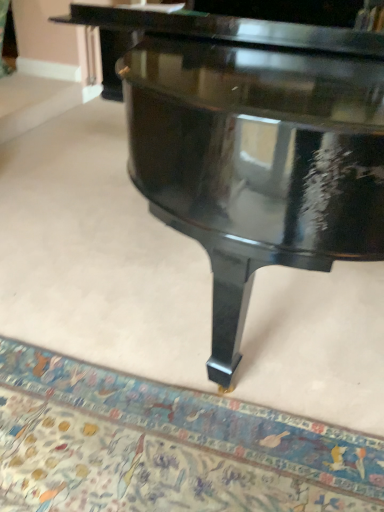
This screenshot has width=384, height=512. What do you see at coordinates (165, 446) in the screenshot? I see `carpet with intricate patterns at lower center` at bounding box center [165, 446].

Measure the distance between carpet with intricate patterns at lower center and camera.

carpet with intricate patterns at lower center is 3.70 feet away from camera.

Identify the location of carpet with intricate patterns at lower center. (165, 446).

What is the approximate width of glossy black piano at center?

It is 6.06 feet.

At what (x,y) coordinates should I click in order to perform the action: click on glossy black piano at center. Please return your answer as a coordinate pair (x, y). This screenshot has height=512, width=384. Looking at the image, I should click on (256, 162).

Measure the distance between glossy black piano at center and camera.

The depth of glossy black piano at center is 75.83 centimeters.

This screenshot has height=512, width=384. Describe the element at coordinates (256, 162) in the screenshot. I see `glossy black piano at center` at that location.

The height and width of the screenshot is (512, 384). Identify the location of carpet with intricate patterns at lower center. (165, 446).

Considering the relative positions of glossy black piano at center and carpet with intricate patterns at lower center in the image provided, is glossy black piano at center to the right of carpet with intricate patterns at lower center from the viewer's perspective?

Indeed, glossy black piano at center is positioned on the right side of carpet with intricate patterns at lower center.

Is glossy black piano at center further to camera compared to carpet with intricate patterns at lower center?

No, glossy black piano at center is closer to the viewer.

Does point (211, 234) come behind point (231, 477)?

No, it is in front of (231, 477).

From the image's perspective, is glossy black piano at center on carpet with intricate patterns at lower center?

Correct, glossy black piano at center appears higher than carpet with intricate patterns at lower center in the image.

From a real-world perspective, which object rests below the other?

In real-world perspective, carpet with intricate patterns at lower center is lower.

Considering the relative sizes of glossy black piano at center and carpet with intricate patterns at lower center in the image provided, is glossy black piano at center wider than carpet with intricate patterns at lower center?

Correct, the width of glossy black piano at center exceeds that of carpet with intricate patterns at lower center.

Considering the sizes of objects glossy black piano at center and carpet with intricate patterns at lower center in the image provided, who is taller, glossy black piano at center or carpet with intricate patterns at lower center?

Standing taller between the two is glossy black piano at center.

Between glossy black piano at center and carpet with intricate patterns at lower center, which one has smaller size?

With smaller size is carpet with intricate patterns at lower center.

In the scene shown: Is glossy black piano at center outside of carpet with intricate patterns at lower center?

Yes.

Is there a large distance between glossy black piano at center and carpet with intricate patterns at lower center?

No, glossy black piano at center is not far away from carpet with intricate patterns at lower center.

Is glossy black piano at center oriented towards carpet with intricate patterns at lower center?

No, glossy black piano at center does not turn towards carpet with intricate patterns at lower center.

In the scene shown: How different are the orientations of glossy black piano at center and carpet with intricate patterns at lower center in degrees?

4.07 degrees separate the facing orientations of glossy black piano at center and carpet with intricate patterns at lower center.

Where is `mat below the glossy black piano at center (from a real-world perspective)`? mat below the glossy black piano at center (from a real-world perspective) is located at coordinates (165, 446).

From the picture: Is carpet with intricate patterns at lower center at the right side of glossy black piano at center?

No, carpet with intricate patterns at lower center is not to the right of glossy black piano at center.

Which object is further away from the camera, carpet with intricate patterns at lower center or glossy black piano at center?

carpet with intricate patterns at lower center.

Which is in front, point (160, 480) or point (308, 148)?

The point (308, 148) is more forward.

In the scene shown: From the image's perspective, is carpet with intricate patterns at lower center above glossy black piano at center?

Actually, carpet with intricate patterns at lower center appears below glossy black piano at center in the image.

From a real-world perspective, is carpet with intricate patterns at lower center located beneath glossy black piano at center?

Yes, from a real-world perspective, carpet with intricate patterns at lower center is under glossy black piano at center.

In terms of width, does carpet with intricate patterns at lower center look wider or thinner when compared to glossy black piano at center?

In the image, carpet with intricate patterns at lower center appears to be more narrow than glossy black piano at center.

In the scene shown: Does carpet with intricate patterns at lower center have a lesser height compared to glossy black piano at center?

Indeed, carpet with intricate patterns at lower center has a lesser height compared to glossy black piano at center.

Looking at this image, does carpet with intricate patterns at lower center have a smaller size compared to glossy black piano at center?

Yes.

Is carpet with intricate patterns at lower center not inside glossy black piano at center?

Yes.

Are carpet with intricate patterns at lower center and glossy black piano at center beside each other?

There is a gap between carpet with intricate patterns at lower center and glossy black piano at center.

Is carpet with intricate patterns at lower center turned away from glossy black piano at center?

No, carpet with intricate patterns at lower center is not facing away from glossy black piano at center.

From the picture: What's the angular difference between carpet with intricate patterns at lower center and glossy black piano at center's facing directions?

They differ by 4.07 degrees in their facing directions.

Where is `piano above the carpet with intricate patterns at lower center (from the image's perspective)`? The image size is (384, 512). piano above the carpet with intricate patterns at lower center (from the image's perspective) is located at coordinates (256, 162).

The width and height of the screenshot is (384, 512). What are the coordinates of `mat behind the glossy black piano at center` in the screenshot? It's located at (165, 446).

Locate an element on the screen. The width and height of the screenshot is (384, 512). piano on the right of carpet with intricate patterns at lower center is located at coordinates (256, 162).